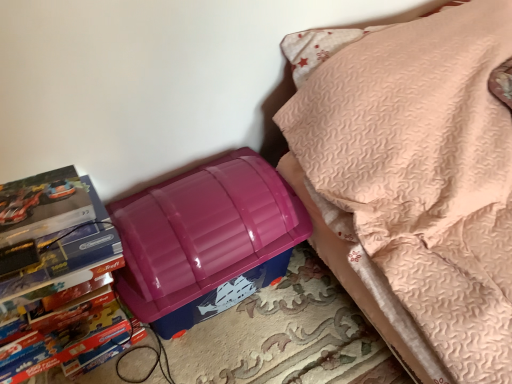
Question: Is matte cardboard book at left closer to the viewer compared to glossy plastic lunch box at lower left?

Choices:
 (A) yes
 (B) no

Answer: (A)

Question: From a real-world perspective, is matte cardboard book at left physically below glossy plastic lunch box at lower left?

Choices:
 (A) no
 (B) yes

Answer: (A)

Question: Are matte cardboard book at left and glossy plastic lunch box at lower left making contact?

Choices:
 (A) yes
 (B) no

Answer: (B)

Question: From the image's perspective, is matte cardboard book at left located above glossy plastic lunch box at lower left?

Choices:
 (A) no
 (B) yes

Answer: (A)

Question: Is matte cardboard book at left positioned behind glossy plastic lunch box at lower left?

Choices:
 (A) no
 (B) yes

Answer: (A)

Question: Is glossy plastic lunch box at lower left inside or outside of matte cardboard book at left?

Choices:
 (A) outside
 (B) inside

Answer: (A)

Question: Based on their positions, is glossy plastic lunch box at lower left located to the left or right of matte cardboard book at left?

Choices:
 (A) right
 (B) left

Answer: (A)

Question: From a real-world perspective, is glossy plastic lunch box at lower left physically located above or below matte cardboard book at left?

Choices:
 (A) below
 (B) above

Answer: (A)

Question: In terms of width, does glossy plastic lunch box at lower left look wider or thinner when compared to matte cardboard book at left?

Choices:
 (A) wide
 (B) thin

Answer: (A)

Question: Considering the positions of glossy plastic lunch box at lower left and purple plastic storage bin at lower left in the image, is glossy plastic lunch box at lower left taller or shorter than purple plastic storage bin at lower left?

Choices:
 (A) short
 (B) tall

Answer: (A)

Question: Considering the positions of glossy plastic lunch box at lower left and purple plastic storage bin at lower left in the image, is glossy plastic lunch box at lower left bigger or smaller than purple plastic storage bin at lower left?

Choices:
 (A) small
 (B) big

Answer: (A)

Question: From a real-world perspective, relative to purple plastic storage bin at lower left, is glossy plastic lunch box at lower left vertically above or below?

Choices:
 (A) below
 (B) above

Answer: (A)

Question: Considering their positions, is glossy plastic lunch box at lower left located in front of or behind purple plastic storage bin at lower left?

Choices:
 (A) front
 (B) behind

Answer: (B)

Question: Is purple plastic storage bin at lower left situated inside glossy plastic lunch box at lower left or outside?

Choices:
 (A) inside
 (B) outside

Answer: (B)

Question: From a real-world perspective, is purple plastic storage bin at lower left physically located above or below glossy plastic lunch box at lower left?

Choices:
 (A) above
 (B) below

Answer: (A)